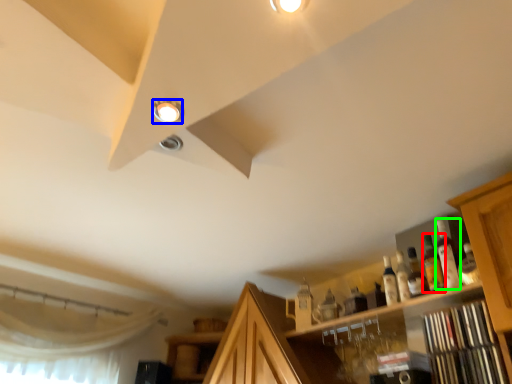
Question: Estimate the real-world distances between objects in this image. Which object is farther from bottle (highlighted by a red box), droplight (highlighted by a blue box) or bottle (highlighted by a green box)?

Choices:
 (A) droplight
 (B) bottle

Answer: (A)